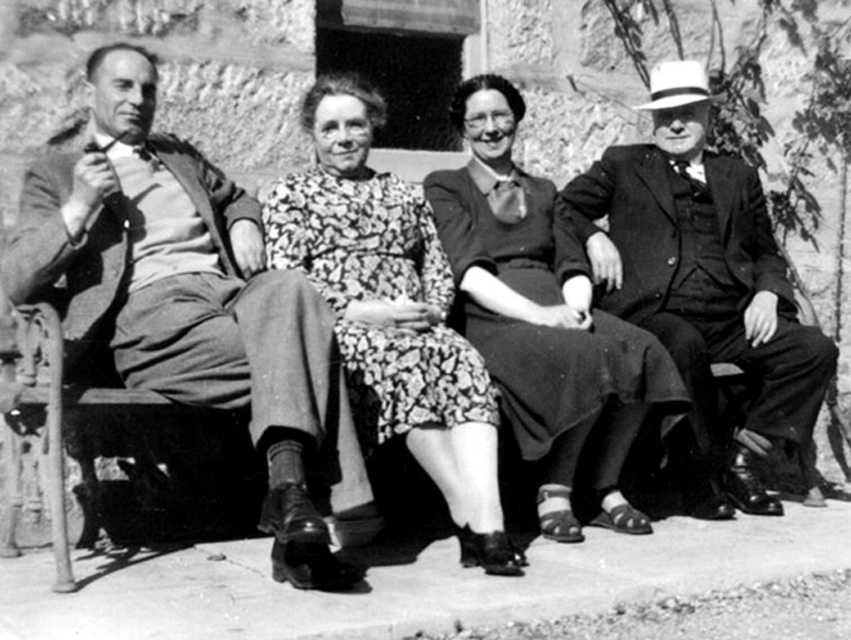
Is smooth fabric suit at left positioned in front of floral dress at center?

Yes, smooth fabric suit at left is closer to the viewer.

Between smooth fabric suit at left and floral dress at center, which one has more height?

With more height is smooth fabric suit at left.

Between point (113, 179) and point (397, 198), which one is positioned behind?

Point (397, 198)

This screenshot has height=640, width=851. I want to click on smooth fabric suit at left, so click(x=193, y=305).

Does point (461, 250) lie in front of point (446, 275)?

No, it is behind (446, 275).

Consider the image. Does matte black dress at center have a lesser height compared to floral dress at center?

Incorrect, matte black dress at center's height does not fall short of floral dress at center's.

This screenshot has height=640, width=851. Identify the location of matte black dress at center. (543, 317).

Where is `matte black dress at center`? This screenshot has height=640, width=851. matte black dress at center is located at coordinates (543, 317).

Is smooth black suit at right closer to the viewer compared to matte black dress at center?

No.

In the scene shown: How far apart are smooth black suit at right and matte black dress at center?

The distance of smooth black suit at right from matte black dress at center is 37.35 inches.

Between point (720, 333) and point (540, 195), which one is positioned behind?

The point (540, 195) is more distant.

Image resolution: width=851 pixels, height=640 pixels. Find the location of `smooth black suit at right`. smooth black suit at right is located at coordinates (704, 276).